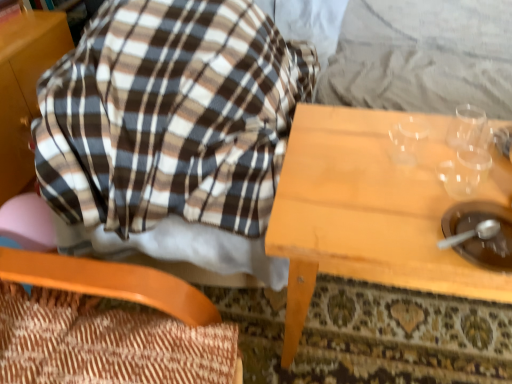
At what (x,y) coordinates should I click in order to perform the action: click on vacant space behind brown matte bowl at lower right. Please return your answer as a coordinate pair (x, y). Looking at the image, I should click on (446, 178).